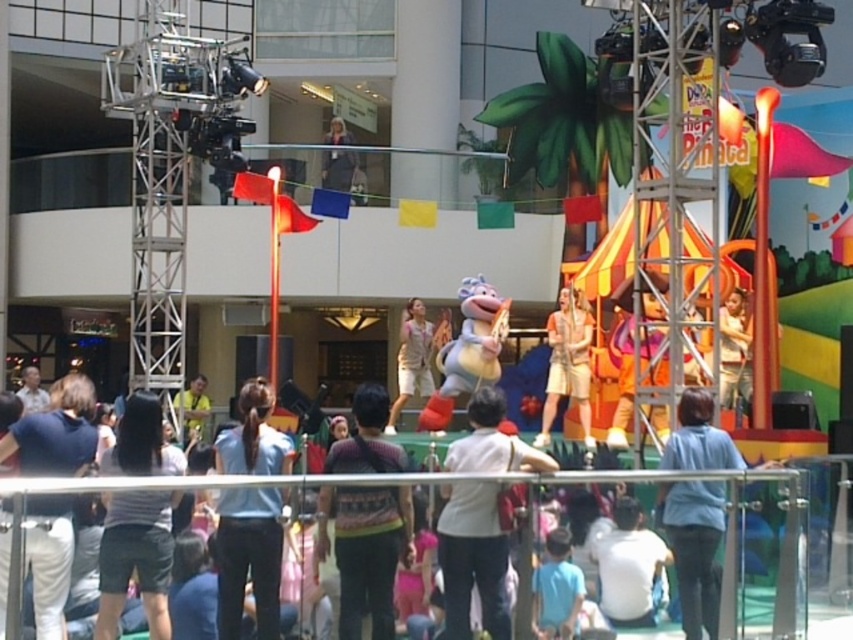
Which is below, striped fabric shirt at center or beige cotton shorts at center?

beige cotton shorts at center

Is striped fabric shirt at center taller than beige cotton shorts at center?

No, striped fabric shirt at center is not taller than beige cotton shorts at center.

What do you see at coordinates (364, 550) in the screenshot?
I see `striped fabric shirt at center` at bounding box center [364, 550].

Locate an element on the screen. The height and width of the screenshot is (640, 853). striped fabric shirt at center is located at coordinates (364, 550).

Does blue cotton shirt at lower center have a greater width compared to yellow fabric at center?

Incorrect, blue cotton shirt at lower center's width does not surpass yellow fabric at center's.

Which is behind, point (689, 544) or point (194, 388)?

Positioned behind is point (194, 388).

Which is in front, point (689, 566) or point (192, 378)?

Positioned in front is point (689, 566).

Identify the location of blue cotton shirt at lower center. (694, 548).

Does striped fabric shirt at center have a lesser height compared to white cotton shirt at lower left?

No, striped fabric shirt at center is not shorter than white cotton shirt at lower left.

The width and height of the screenshot is (853, 640). Find the location of `striped fabric shirt at center`. striped fabric shirt at center is located at coordinates (364, 550).

The image size is (853, 640). Find the location of `striped fabric shirt at center`. striped fabric shirt at center is located at coordinates (364, 550).